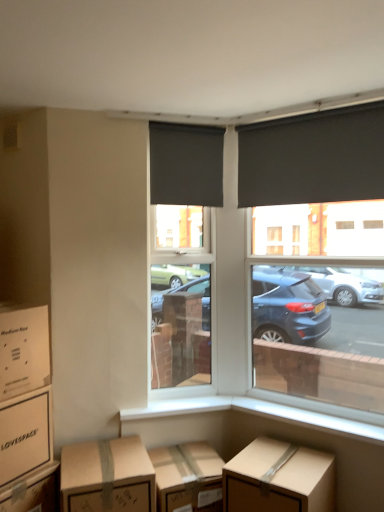
Question: Is brown cardboard box at lower center, which ranks as the fifth box in left-to-right order, surrounding brown cardboard box at lower left, acting as the third box starting from the right?

Choices:
 (A) yes
 (B) no

Answer: (B)

Question: Can you confirm if brown cardboard box at lower center, which ranks as the fifth box in left-to-right order, is bigger than brown cardboard box at lower left, positioned as the 3th box in left-to-right order?

Choices:
 (A) yes
 (B) no

Answer: (A)

Question: Can you confirm if brown cardboard box at lower center, positioned as the first box in right-to-left order, is positioned to the left of brown cardboard box at lower left, positioned as the 3th box in left-to-right order?

Choices:
 (A) yes
 (B) no

Answer: (B)

Question: From a real-world perspective, is brown cardboard box at lower center, positioned as the first box in right-to-left order, below brown cardboard box at lower left, acting as the third box starting from the right?

Choices:
 (A) yes
 (B) no

Answer: (A)

Question: Considering the relative sizes of brown cardboard box at lower center, positioned as the first box in right-to-left order, and brown cardboard box at lower left, positioned as the 3th box in left-to-right order, in the image provided, is brown cardboard box at lower center, positioned as the first box in right-to-left order, shorter than brown cardboard box at lower left, positioned as the 3th box in left-to-right order,?

Choices:
 (A) yes
 (B) no

Answer: (B)

Question: Does point (248, 141) appear closer or farther from the camera than point (291, 482)?

Choices:
 (A) farther
 (B) closer

Answer: (A)

Question: Is matte black roller blind at upper right, marked as the 1th window blind in a right-to-left arrangement, taller or shorter than brown cardboard box at lower center, positioned as the first box in right-to-left order?

Choices:
 (A) short
 (B) tall

Answer: (B)

Question: Looking at their shapes, would you say matte black roller blind at upper right, which is counted as the second window blind, starting from the left, is wider or thinner than brown cardboard box at lower center, which ranks as the fifth box in left-to-right order?

Choices:
 (A) wide
 (B) thin

Answer: (B)

Question: Do you think matte black roller blind at upper right, which is counted as the second window blind, starting from the left, is within brown cardboard box at lower center, positioned as the first box in right-to-left order, or outside of it?

Choices:
 (A) inside
 (B) outside

Answer: (B)

Question: Which is correct: black roller blind at upper right is inside matte black roller blind at center, or outside of it?

Choices:
 (A) inside
 (B) outside

Answer: (B)

Question: In terms of height, does black roller blind at upper right look taller or shorter compared to matte black roller blind at center?

Choices:
 (A) short
 (B) tall

Answer: (B)

Question: Does point (307, 223) appear closer or farther from the camera than point (188, 366)?

Choices:
 (A) closer
 (B) farther

Answer: (B)

Question: Considering the positions of black roller blind at upper right and matte black roller blind at center in the image, is black roller blind at upper right wider or thinner than matte black roller blind at center?

Choices:
 (A) wide
 (B) thin

Answer: (B)

Question: From a real-world perspective, is matte black roller blind at upper right, marked as the 1th window blind in a right-to-left arrangement, above or below brown cardboard box at lower left, positioned as the 3th box in left-to-right order?

Choices:
 (A) below
 (B) above

Answer: (B)

Question: Does point (273, 178) appear closer or farther from the camera than point (41, 470)?

Choices:
 (A) closer
 (B) farther

Answer: (B)